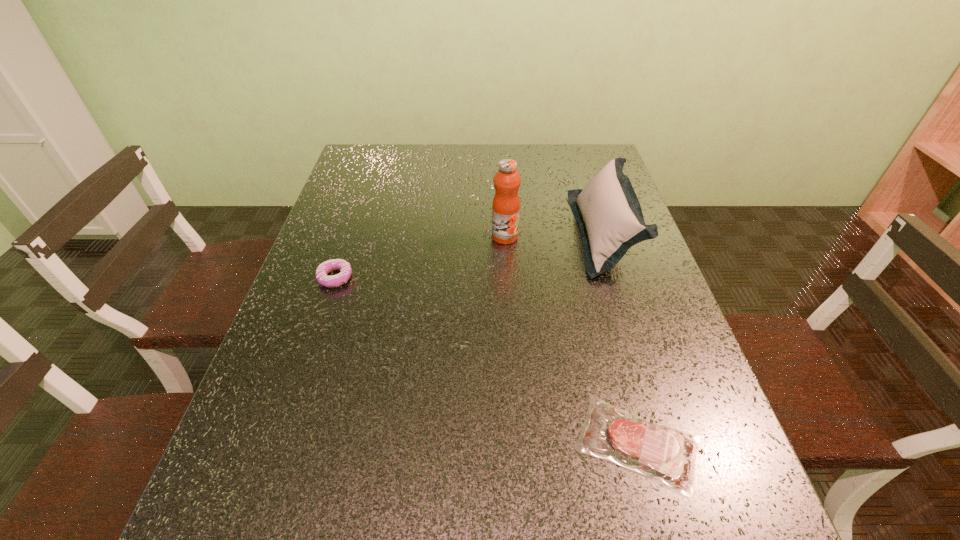
Locate an element on the screen. free space located on the surface of the cushion is located at coordinates (438, 233).

Locate an element on the screen. vacant space situated on the back of the third tallest object is located at coordinates (344, 253).

Find the location of a particular element. Image resolution: width=960 pixels, height=540 pixels. vacant area located on the left of the shortest object is located at coordinates (521, 444).

This screenshot has height=540, width=960. In order to click on object that is at the left edge in this screenshot , I will do click(x=326, y=267).

I want to click on cushion that is positioned at the right edge, so click(x=610, y=218).

In order to click on steak that is positioned at the right edge in this screenshot , I will do `click(662, 453)`.

Image resolution: width=960 pixels, height=540 pixels. I want to click on free space at the far edge, so pos(407,148).

You are a GUI agent. You are given a task and a screenshot of the screen. Output one action in this format:
    pyautogui.click(x=<x>, y=<y>)
    Task: Click on the vacant region at the left edge
    The height and width of the screenshot is (540, 960).
    Given the screenshot: What is the action you would take?
    pyautogui.click(x=363, y=184)

Find the location of a particular element. This screenshot has height=540, width=960. free space at the right edge of the desktop is located at coordinates (664, 319).

The image size is (960, 540). In the image, there is a desktop. In order to click on free space at the far left corner in this screenshot , I will do `click(352, 181)`.